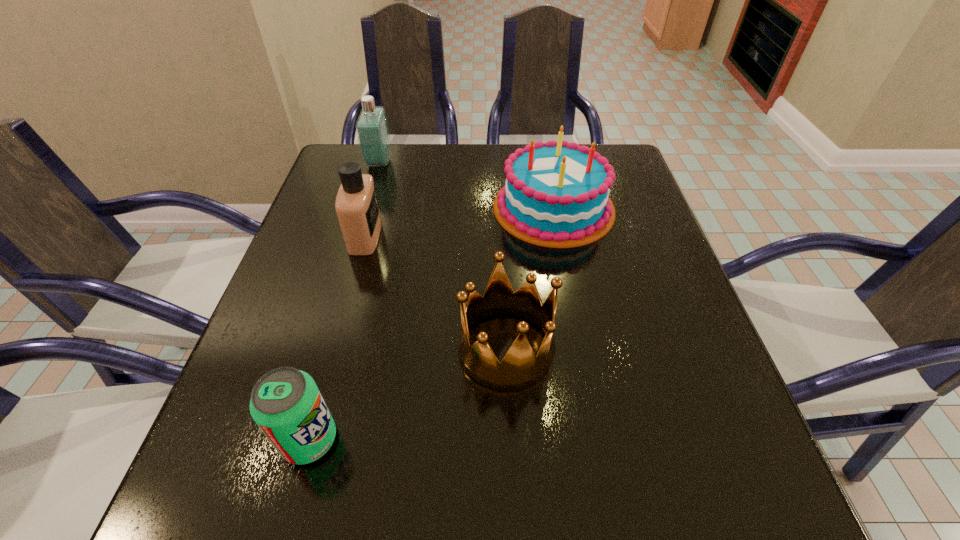
This screenshot has height=540, width=960. Identify the location of the farther perfume. [372, 130].

Where is `birthday cake`? Image resolution: width=960 pixels, height=540 pixels. birthday cake is located at coordinates (556, 193).

Identify the location of the nearer perfume. The width and height of the screenshot is (960, 540). (357, 208).

The width and height of the screenshot is (960, 540). I want to click on crown, so point(520,367).

Identify the location of pop soda. Image resolution: width=960 pixels, height=540 pixels. (286, 404).

Locate an element on the screen. The height and width of the screenshot is (540, 960). free space located on the front label of the farther perfume is located at coordinates click(413, 163).

Where is `blank area located 0.070m on the left of the birthday cake`? Image resolution: width=960 pixels, height=540 pixels. blank area located 0.070m on the left of the birthday cake is located at coordinates (464, 208).

This screenshot has width=960, height=540. In order to click on free location located 0.370m on the front label of the nearer perfume in this screenshot , I will do `click(545, 236)`.

Locate an element on the screen. This screenshot has height=540, width=960. free space located 0.270m on the back of the crown is located at coordinates (500, 221).

This screenshot has width=960, height=540. I want to click on vacant space located 0.130m on the front-facing side of the pop soda, so click(x=423, y=440).